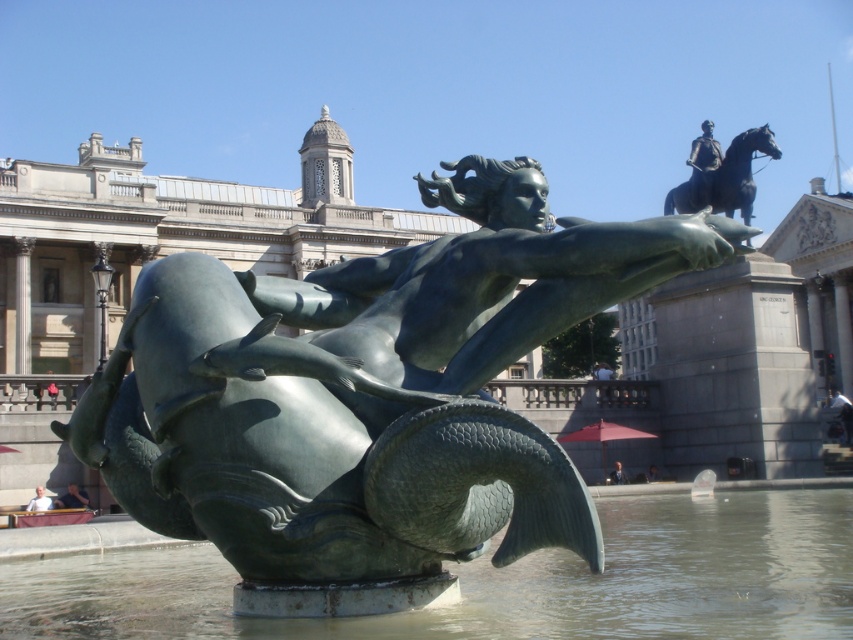
Question: Which of these objects is positioned closest to the polished bronze statue at upper right?

Choices:
 (A) greenish water at center
 (B) green polished bronze mermaid at center

Answer: (A)

Question: Which is nearer to the green polished bronze mermaid at center?

Choices:
 (A) polished bronze statue at upper right
 (B) greenish water at center

Answer: (B)

Question: Can you confirm if green polished bronze mermaid at center is positioned above polished bronze statue at upper right?

Choices:
 (A) no
 (B) yes

Answer: (A)

Question: Which of the following is the closest to the observer?

Choices:
 (A) (521, 467)
 (B) (802, 563)
 (C) (688, 188)

Answer: (A)

Question: Is green polished bronze mermaid at center to the right of polished bronze statue at upper right from the viewer's perspective?

Choices:
 (A) no
 (B) yes

Answer: (A)

Question: From the image, what is the correct spatial relationship of green polished bronze mermaid at center in relation to polished bronze statue at upper right?

Choices:
 (A) left
 (B) right

Answer: (A)